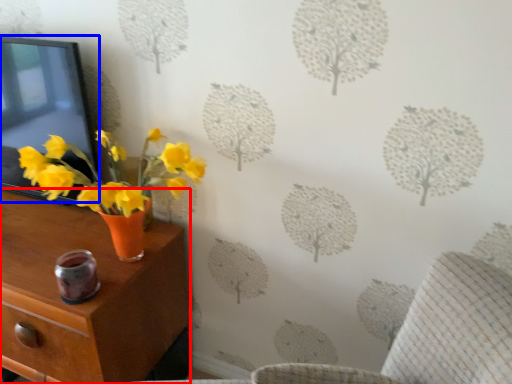
Question: Which point is closer to the camera, nightstand (highlighted by a red box) or picture frame (highlighted by a blue box)?

Choices:
 (A) nightstand
 (B) picture frame

Answer: (A)